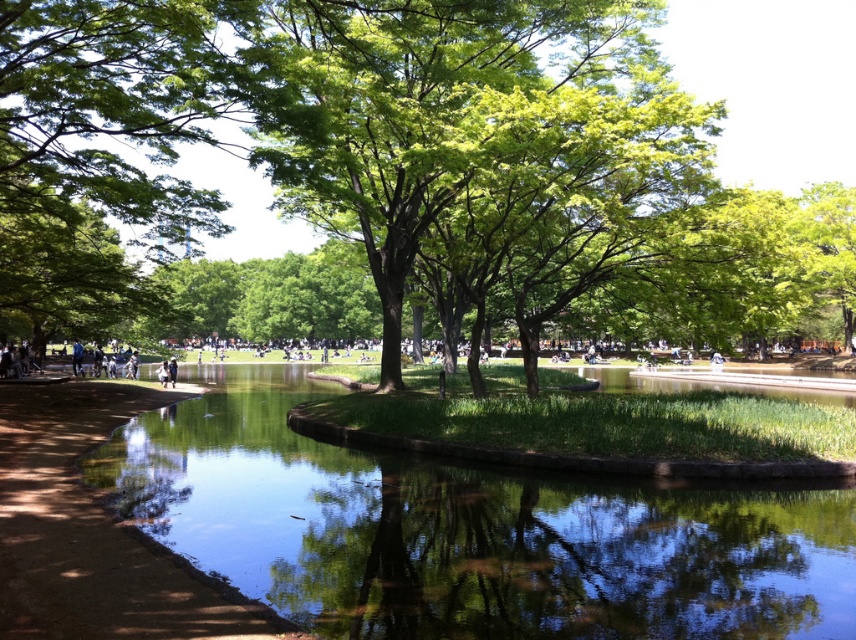
Question: Which point is farther from the camera taking this photo?

Choices:
 (A) (82, 269)
 (B) (70, 458)

Answer: (A)

Question: Is green leafy tree at left above dirt path at lower left?

Choices:
 (A) yes
 (B) no

Answer: (A)

Question: Which point appears closest to the camera in this image?

Choices:
 (A) (18, 608)
 (B) (58, 96)

Answer: (A)

Question: Which point appears farthest from the camera in this image?

Choices:
 (A) (99, 413)
 (B) (94, 106)

Answer: (A)

Question: Is green leafy tree at left positioned behind dirt path at lower left?

Choices:
 (A) yes
 (B) no

Answer: (A)

Question: Can you confirm if clear water at center is wider than green leafy tree at center?

Choices:
 (A) no
 (B) yes

Answer: (A)